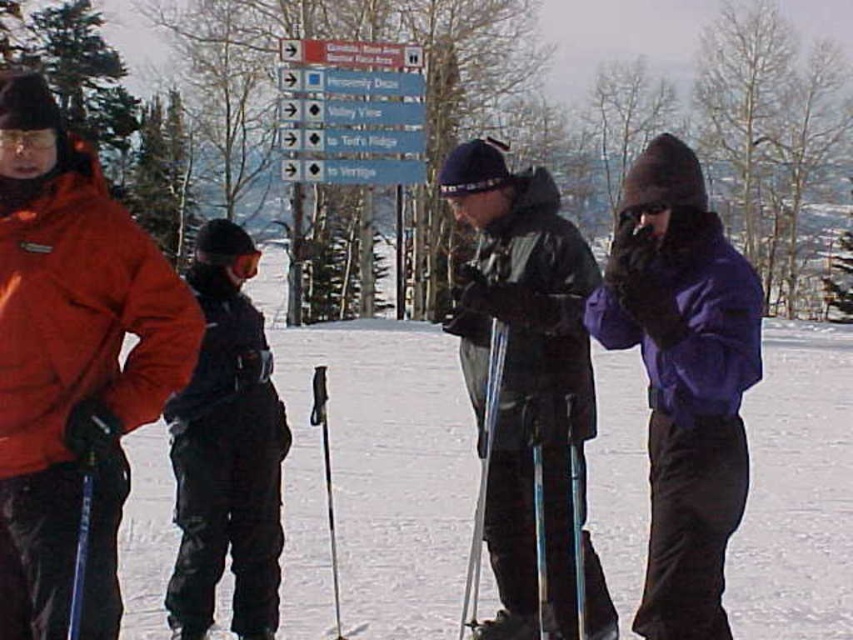
Question: Does orange softshell jacket at left lie in front of black matte ski pants at center?

Choices:
 (A) yes
 (B) no

Answer: (A)

Question: Which object is closer to the camera taking this photo?

Choices:
 (A) orange softshell jacket at left
 (B) blue metallic ski pole at center

Answer: (A)

Question: Considering the real-world distances, which object is closest to the orange softshell jacket at left?

Choices:
 (A) matte black ski pole at center
 (B) black matte ski pants at center

Answer: (B)

Question: Which point appears closest to the camera in this image?

Choices:
 (A) (138, 397)
 (B) (485, 470)
 (C) (218, 500)
 (D) (483, 204)

Answer: (A)

Question: Does purple fleece jacket at right appear under matte black ski pole at center?

Choices:
 (A) yes
 (B) no

Answer: (B)

Question: Does orange softshell jacket at left have a greater width compared to blue metallic ski pole at center?

Choices:
 (A) no
 (B) yes

Answer: (B)